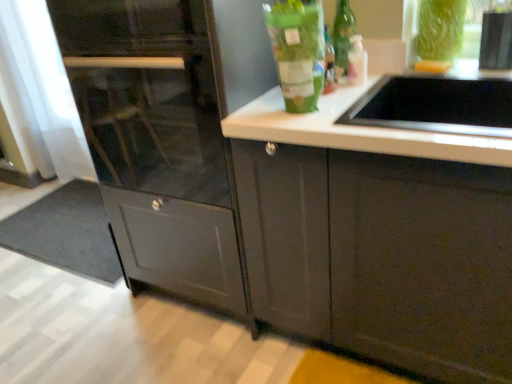
Question: Are translucent glass bottle at upper right, the 1th bottle in the back-to-front sequence, and gray matte doormat at lower left beside each other?

Choices:
 (A) yes
 (B) no

Answer: (B)

Question: Does translucent glass bottle at upper right, which is the 2th bottle in left-to-right order, appear on the left side of gray matte doormat at lower left?

Choices:
 (A) yes
 (B) no

Answer: (B)

Question: From a real-world perspective, is translucent glass bottle at upper right, placed as the first bottle when sorted from right to left, below gray matte doormat at lower left?

Choices:
 (A) no
 (B) yes

Answer: (A)

Question: Is translucent glass bottle at upper right, which is the 2th bottle in left-to-right order, not close to gray matte doormat at lower left?

Choices:
 (A) no
 (B) yes

Answer: (B)

Question: From the image's perspective, is translucent glass bottle at upper right, placed as the first bottle when sorted from right to left, on top of gray matte doormat at lower left?

Choices:
 (A) yes
 (B) no

Answer: (A)

Question: Is point (342, 8) positioned closer to the camera than point (184, 276)?

Choices:
 (A) farther
 (B) closer

Answer: (B)

Question: In terms of size, does green glass bottle at upper center appear bigger or smaller than matte gray cabinet at center?

Choices:
 (A) big
 (B) small

Answer: (B)

Question: In terms of height, does green glass bottle at upper center look taller or shorter compared to matte gray cabinet at center?

Choices:
 (A) short
 (B) tall

Answer: (A)

Question: Which is correct: green glass bottle at upper center is inside matte gray cabinet at center, or outside of it?

Choices:
 (A) inside
 (B) outside

Answer: (B)

Question: In the image, is translucent glass bottle at upper right, the 1th bottle in the back-to-front sequence, positioned in front of or behind gray matte doormat at lower left?

Choices:
 (A) behind
 (B) front

Answer: (B)

Question: Is translucent glass bottle at upper right, the 1th bottle in the back-to-front sequence, to the left or to the right of gray matte doormat at lower left in the image?

Choices:
 (A) right
 (B) left

Answer: (A)

Question: Based on their sizes in the image, would you say translucent glass bottle at upper right, the 2th bottle from the front, is bigger or smaller than gray matte doormat at lower left?

Choices:
 (A) small
 (B) big

Answer: (A)

Question: Choose the correct answer: Is translucent glass bottle at upper right, which is the 2th bottle in left-to-right order, inside gray matte doormat at lower left or outside it?

Choices:
 (A) outside
 (B) inside

Answer: (A)

Question: In terms of height, does matte gray cabinet at center look taller or shorter compared to gray matte doormat at lower left?

Choices:
 (A) tall
 (B) short

Answer: (A)

Question: In terms of width, does matte gray cabinet at center look wider or thinner when compared to gray matte doormat at lower left?

Choices:
 (A) thin
 (B) wide

Answer: (A)